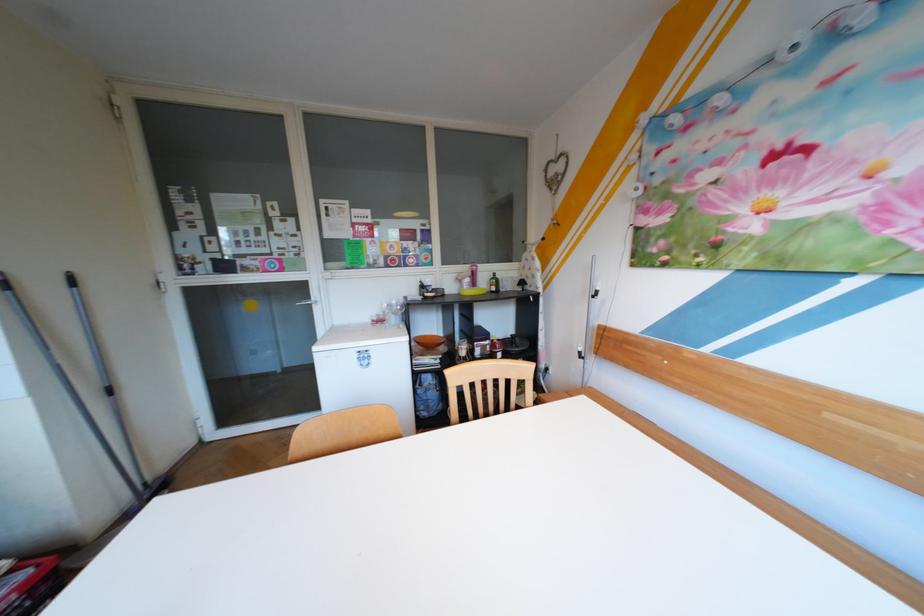
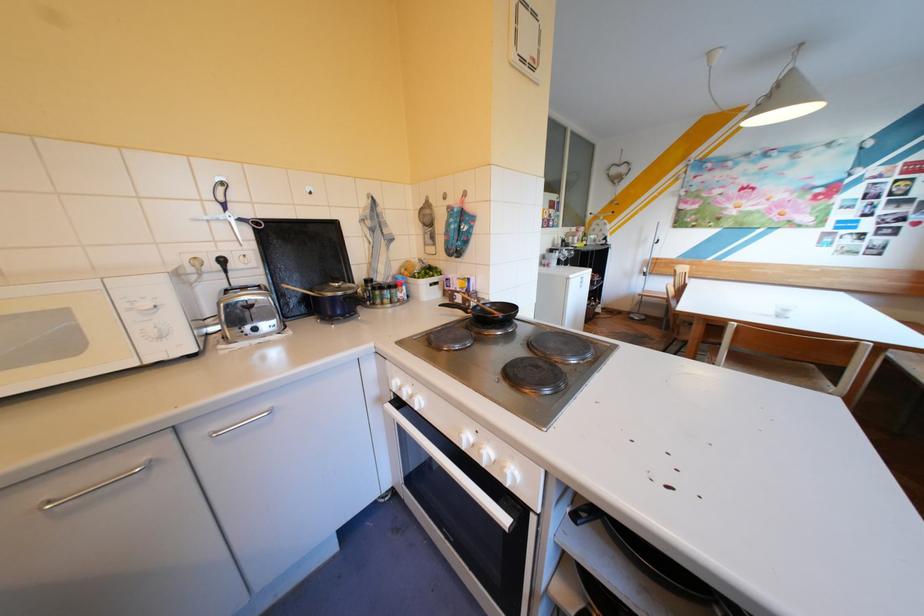
Question: I am providing you with two images of the same scene from different viewpoints. Which of the following objects are not visible in image2?

Choices:
 (A) clear wine glass
 (B) blue cooking pot
 (C) black conference phone
 (D) white oven knob

Answer: (A)